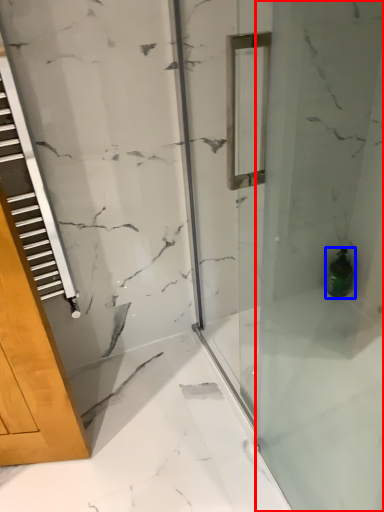
Question: Which point is further to the camera, shower door (highlighted by a red box) or bottle (highlighted by a blue box)?

Choices:
 (A) shower door
 (B) bottle

Answer: (B)